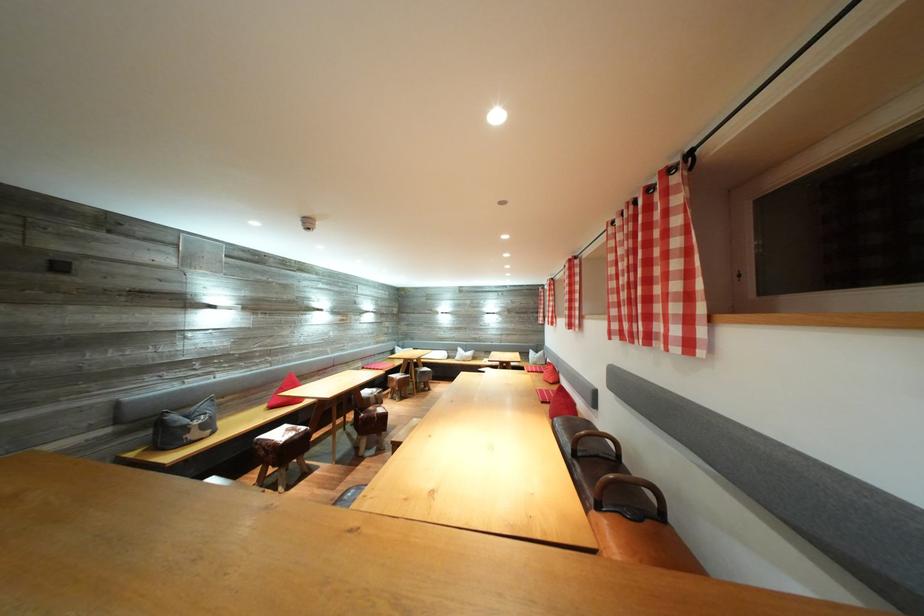
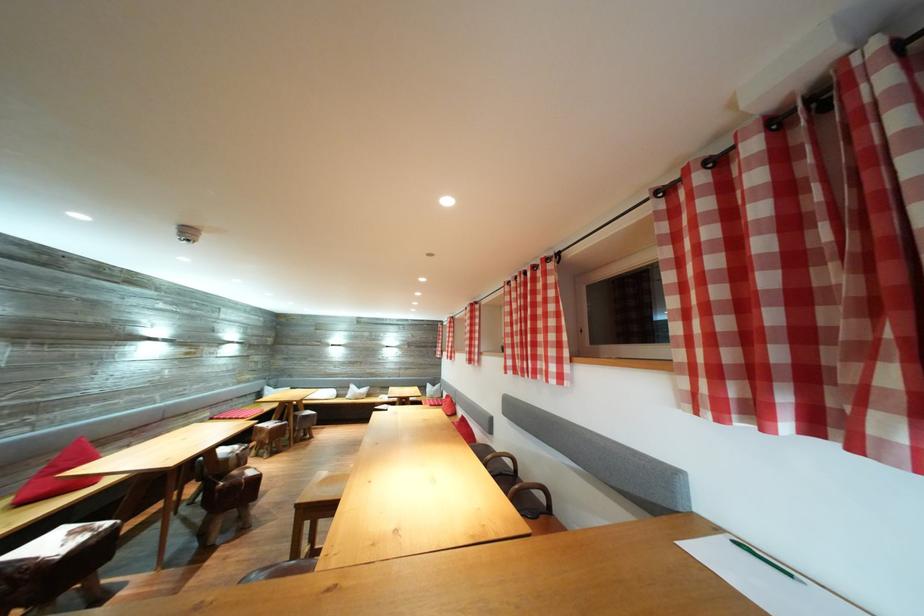
The point at [623,467] is marked in the first image. Where is the corresponding point in the second image?

(521, 480)